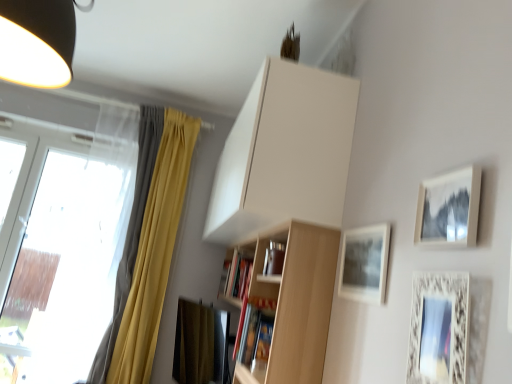
Find the location of a particular element. hardcover book at center, placed as the first book when sorted from front to back is located at coordinates (254, 330).

The width and height of the screenshot is (512, 384). Describe the element at coordinates (63, 245) in the screenshot. I see `transparent glass window at left` at that location.

What is the approximate width of matte white picture frame at upper right, which is the 2th picture frame in front-to-back order?

It is 1.40 inches.

This screenshot has width=512, height=384. Describe the element at coordinates (438, 328) in the screenshot. I see `white ornate picture frame at lower right, which appears as the first picture frame when viewed from the front` at that location.

The width and height of the screenshot is (512, 384). Identify the location of yellow fabric curtain at left. (147, 247).

Is yellow fabric curtain at left positioned before white matte cabinet at upper center?

No, the depth of yellow fabric curtain at left is greater than that of white matte cabinet at upper center.

From the image's perspective, is yellow fabric curtain at left on top of white matte cabinet at upper center?

No, from the image's perspective, yellow fabric curtain at left is not over white matte cabinet at upper center.

Is yellow fabric curtain at left to the right of white matte cabinet at upper center from the viewer's perspective?

No, yellow fabric curtain at left is not to the right of white matte cabinet at upper center.

Where is `curtain that appears below the white matte cabinet at upper center (from the image's perspective)`? The width and height of the screenshot is (512, 384). curtain that appears below the white matte cabinet at upper center (from the image's perspective) is located at coordinates (147, 247).

In the scene shown: Is the position of white ornate picture frame at lower right, which is the third picture frame from back to front, more distant than that of hardcover book at center, arranged as the 2th book when viewed from the front?

No, the depth of white ornate picture frame at lower right, which is the third picture frame from back to front, is less than that of hardcover book at center, arranged as the 2th book when viewed from the front.

How many degrees apart are the facing directions of white ornate picture frame at lower right, which is the third picture frame from back to front, and hardcover book at center, arranged as the 2th book when viewed from the front?

4.38 degrees.

Which point is more forward, (429, 327) or (251, 266)?

The point (429, 327) is in front.

From the picture: Is white matte cabinet at upper center far from yellow fabric curtain at left?

white matte cabinet at upper center is far away from yellow fabric curtain at left.

At what (x,y) coordinates should I click in order to perform the action: click on cabinetry in front of the yellow fabric curtain at left. Please return your answer as a coordinate pair (x, y). This screenshot has width=512, height=384. Looking at the image, I should click on (285, 153).

Is white matte cabinet at upper center wider or thinner than yellow fabric curtain at left?

white matte cabinet at upper center is wider than yellow fabric curtain at left.

Does point (302, 115) come in front of point (117, 354)?

Yes, it is in front of point (117, 354).

Is point (261, 358) less distant than point (139, 227)?

Yes, point (261, 358) is closer to viewer.

From the image's perspective, is hardcover book at center, placed as the first book when sorted from front to back, under yellow fabric curtain at left?

Correct, hardcover book at center, placed as the first book when sorted from front to back, appears lower than yellow fabric curtain at left in the image.

Who is shorter, hardcover book at center, the second book when ordered from back to front, or yellow fabric curtain at left?

Standing shorter between the two is hardcover book at center, the second book when ordered from back to front.

Locate an element on the screen. the 2nd book in front of the yellow fabric curtain at left, counting from the anchor's position is located at coordinates (254, 330).

Do you think matte gray picture frame at upper right, which is counted as the first picture frame, starting from the back, is within hardcover book at center, the second book when ordered from back to front, or outside of it?

matte gray picture frame at upper right, which is counted as the first picture frame, starting from the back, cannot be found inside hardcover book at center, the second book when ordered from back to front.

Looking at their sizes, would you say matte gray picture frame at upper right, which is counted as the first picture frame, starting from the back, is wider or thinner than hardcover book at center, the second book when ordered from back to front?

Considering their sizes, matte gray picture frame at upper right, which is counted as the first picture frame, starting from the back, looks slimmer than hardcover book at center, the second book when ordered from back to front.

From their relative heights in the image, would you say matte gray picture frame at upper right, which is counted as the first picture frame, starting from the back, is taller or shorter than hardcover book at center, the second book when ordered from back to front?

Considering their sizes, matte gray picture frame at upper right, which is counted as the first picture frame, starting from the back, has less height than hardcover book at center, the second book when ordered from back to front.

Looking at this image, how different are the orientations of matte gray picture frame at upper right, which is counted as the first picture frame, starting from the back, and hardcover book at center, the second book when ordered from back to front, in degrees?

The angular difference between matte gray picture frame at upper right, which is counted as the first picture frame, starting from the back, and hardcover book at center, the second book when ordered from back to front, is 1.41 degrees.

From a real-world perspective, is white matte cabinet at upper center over matte white picture frame at upper right, the 2th picture frame when ordered from back to front?

Indeed, from a real-world perspective, white matte cabinet at upper center stands above matte white picture frame at upper right, the 2th picture frame when ordered from back to front.

Is white matte cabinet at upper center in front of matte white picture frame at upper right, which is the 2th picture frame in front-to-back order?

No, white matte cabinet at upper center is further to the viewer.

From the picture: Between transparent glass window at left and hardcover book at center, the second book when ordered from back to front, which one has larger size?

Bigger between the two is transparent glass window at left.

Considering the relative sizes of transparent glass window at left and hardcover book at center, placed as the first book when sorted from front to back, in the image provided, is transparent glass window at left shorter than hardcover book at center, placed as the first book when sorted from front to back,?

No, transparent glass window at left is not shorter than hardcover book at center, placed as the first book when sorted from front to back.

Is transparent glass window at left not inside hardcover book at center, placed as the first book when sorted from front to back?

Yes.

The image size is (512, 384). I want to click on curtain behind the white matte cabinet at upper center, so click(147, 247).

Starting from the hardcover book at center, which is the first book in back-to-front order, which picture frame is the 3rd one in front? Please provide its 2D coordinates.

[(438, 328)]

Looking at the image, which one is located further to hardcover book at center, the second book when ordered from back to front, matte gray picture frame at upper right, the 3th picture frame in the front-to-back sequence, or transparent glass window at left?

transparent glass window at left.

Based on their spatial positions, is transparent glass window at left or yellow fabric curtain at left closer to matte gray picture frame at upper right, which is counted as the first picture frame, starting from the back?

yellow fabric curtain at left.

Based on their spatial positions, is matte white picture frame at upper right, which is the 2th picture frame in front-to-back order, or yellow fabric curtain at left further from hardcover book at center, arranged as the 2th book when viewed from the front?

Based on the image, matte white picture frame at upper right, which is the 2th picture frame in front-to-back order, appears to be further to hardcover book at center, arranged as the 2th book when viewed from the front.

Considering their positions, is yellow fabric curtain at left positioned further to transparent glass window at left than white matte cabinet at upper center?

white matte cabinet at upper center.

Considering their positions, is transparent glass window at left positioned closer to matte white picture frame at upper right, the 2th picture frame when ordered from back to front, than hardcover book at center, the second book when ordered from back to front?

hardcover book at center, the second book when ordered from back to front.

Which object lies further to the anchor point hardcover book at center, the second book when ordered from back to front, transparent glass window at left or matte gray picture frame at upper right, the 3th picture frame in the front-to-back sequence?

transparent glass window at left.

Which object lies further to the anchor point transparent glass window at left, white ornate picture frame at lower right, which appears as the first picture frame when viewed from the front, or white matte cabinet at upper center?

white ornate picture frame at lower right, which appears as the first picture frame when viewed from the front.

Which object lies nearer to the anchor point hardcover book at center, arranged as the 2th book when viewed from the front, matte white picture frame at upper right, the 2th picture frame when ordered from back to front, or transparent glass window at left?

Among the two, transparent glass window at left is located nearer to hardcover book at center, arranged as the 2th book when viewed from the front.

At what (x,y) coordinates should I click in order to perform the action: click on book between white ornate picture frame at lower right, which is the third picture frame from back to front, and hardcover book at center, arranged as the 2th book when viewed from the front, in the front-back direction. Please return your answer as a coordinate pair (x, y). Looking at the image, I should click on (254, 330).

You are a GUI agent. You are given a task and a screenshot of the screen. Output one action in this format:
    pyautogui.click(x=<x>, y=<y>)
    Task: Click on the cabinetry between white ornate picture frame at lower right, which is the third picture frame from back to front, and yellow fabric curtain at left from front to back
    Image resolution: width=512 pixels, height=384 pixels.
    Given the screenshot: What is the action you would take?
    pyautogui.click(x=285, y=153)

I want to click on window positioned between matte white picture frame at upper right, the 2th picture frame when ordered from back to front, and yellow fabric curtain at left from near to far, so click(x=63, y=245).

Where is `picture frame located between white ornate picture frame at lower right, which appears as the first picture frame when viewed from the front, and matte gray picture frame at upper right, the 3th picture frame in the front-to-back sequence, in the depth direction`? Image resolution: width=512 pixels, height=384 pixels. picture frame located between white ornate picture frame at lower right, which appears as the first picture frame when viewed from the front, and matte gray picture frame at upper right, the 3th picture frame in the front-to-back sequence, in the depth direction is located at coordinates (449, 209).